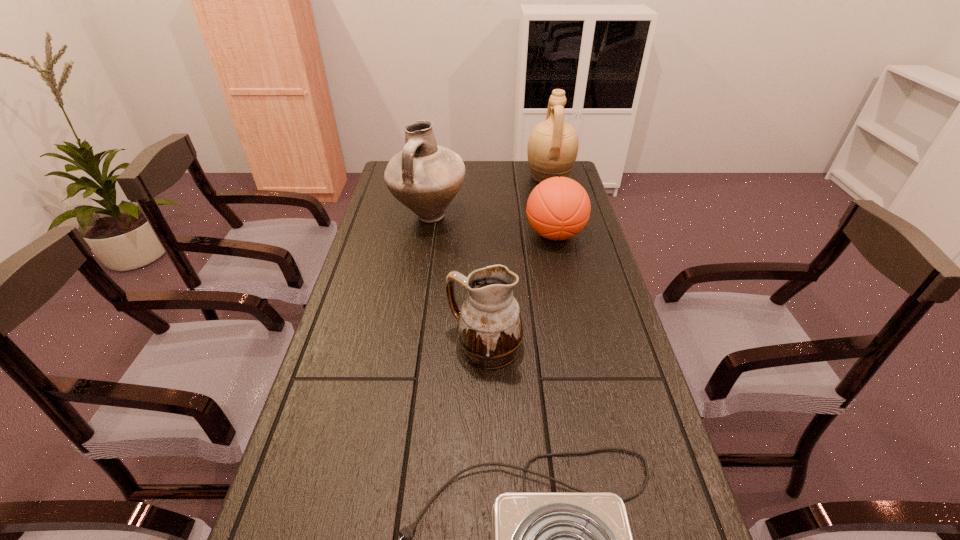
At what (x,y) coordinates should I click in order to perform the action: click on the rightmost pitcher. Please return your answer as a coordinate pair (x, y). The width and height of the screenshot is (960, 540). Looking at the image, I should click on (552, 149).

In order to click on the farthest pitcher in this screenshot , I will do `click(552, 149)`.

The height and width of the screenshot is (540, 960). In order to click on the second nearest pitcher in this screenshot , I will do `click(425, 177)`.

The image size is (960, 540). In order to click on the third shortest object in this screenshot , I will do `click(489, 331)`.

Find the location of a particular element. This screenshot has height=540, width=960. the second nearest object is located at coordinates (489, 331).

You are a GUI agent. You are given a task and a screenshot of the screen. Output one action in this format:
    pyautogui.click(x=<x>, y=<y>)
    Task: Click on the basketball
    
    Given the screenshot: What is the action you would take?
    pyautogui.click(x=558, y=208)

This screenshot has height=540, width=960. Find the location of `vacant space located on the front of the farthest pitcher`. vacant space located on the front of the farthest pitcher is located at coordinates (555, 198).

Image resolution: width=960 pixels, height=540 pixels. Identify the location of vacant point located on the handle side of the second farthest pitcher. (420, 275).

Find the location of a particular element. The height and width of the screenshot is (540, 960). free space located 0.300m from the spout of the third tallest object is located at coordinates (329, 347).

This screenshot has height=540, width=960. In order to click on blank area located from the spout of the third tallest object in this screenshot , I will do `click(420, 347)`.